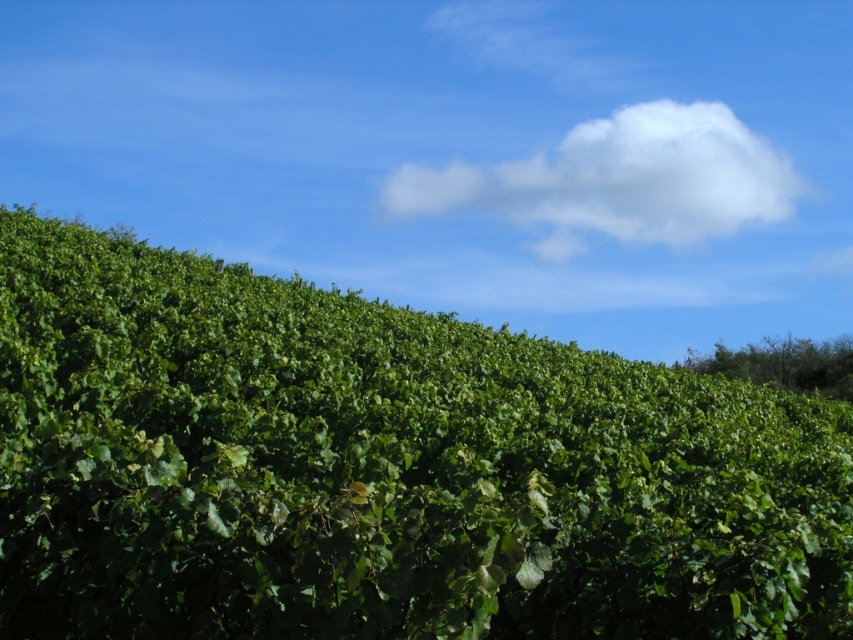
You are a drone operator flying a drone over a vineyard. Your drone is currently above the green leafy hedge at center. You need to fly it to the exact center of the vineyard. In which direction should you move the drone to reach the center?

The green leafy hedge at center is located at point 0.733 on the x axis and 0.449 on the y axis. Since the exact center of the vineyard would be at point 0.5 on both axes, you should move the drone to the left and upwards to reach the center.

You are a landscape photographer planning to capture the vineyard scene. You want to ensure that the green leafy hedge at center and the white fluffy cloud at upper center are both visible in your shot. Given their sizes, which object would appear smaller in the final photograph?

The green leafy hedge at center would appear smaller in the photograph because its width is less than that of the white fluffy cloud at upper center.

You are an agricultural drone flying at a low altitude above the vineyard. You need to navigate between the green leafy hedge at center and the white fluffy cloud at upper center. Which object is closer to you?

The green leafy hedge at center is closer to you since it has a lesser height compared to the white fluffy cloud at upper center.